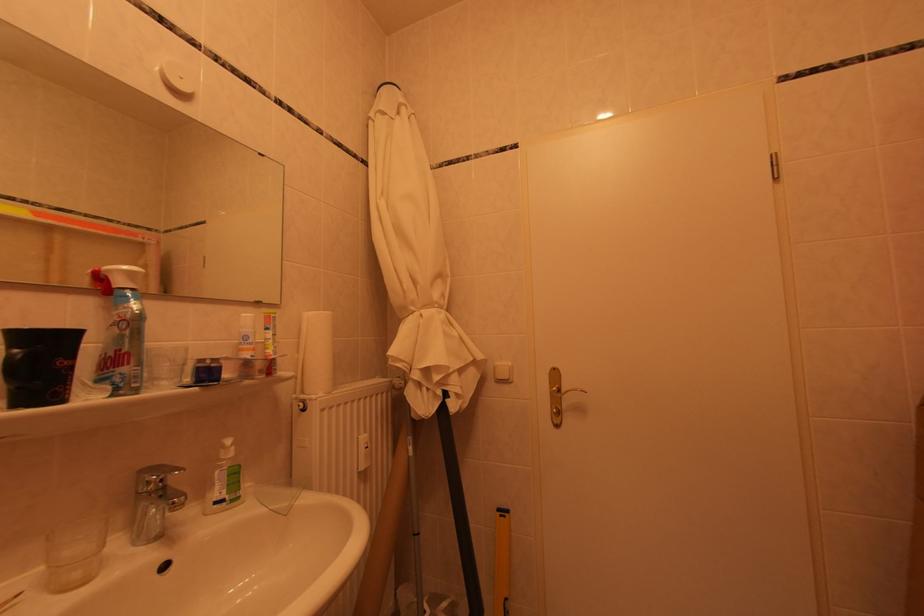
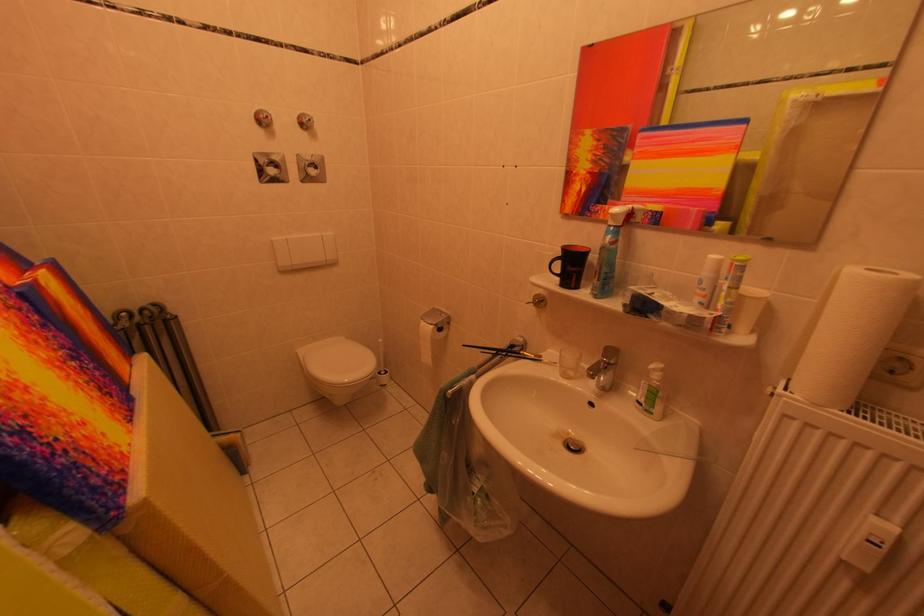
Based on the continuous images, in which direction is the camera rotating?

The camera's rotation is toward left-down.